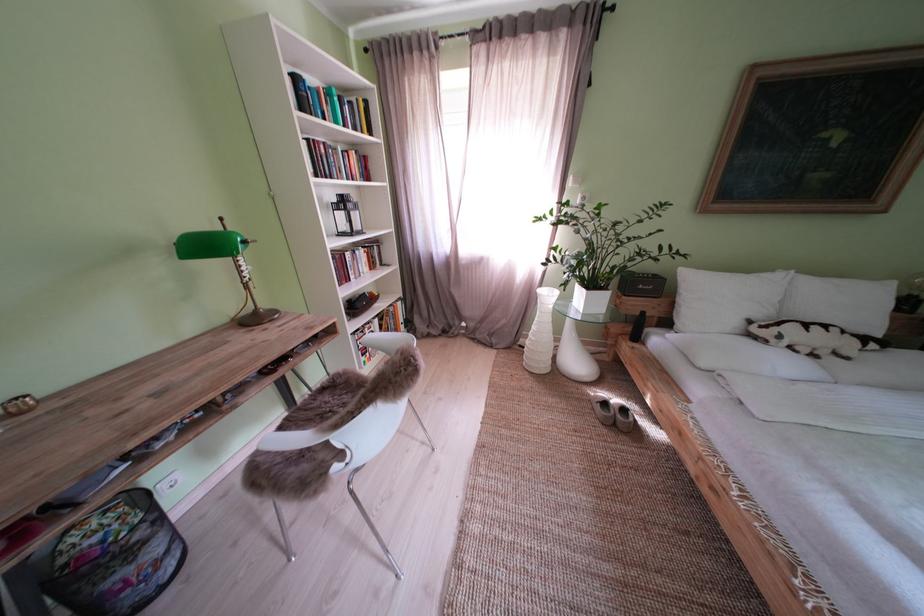
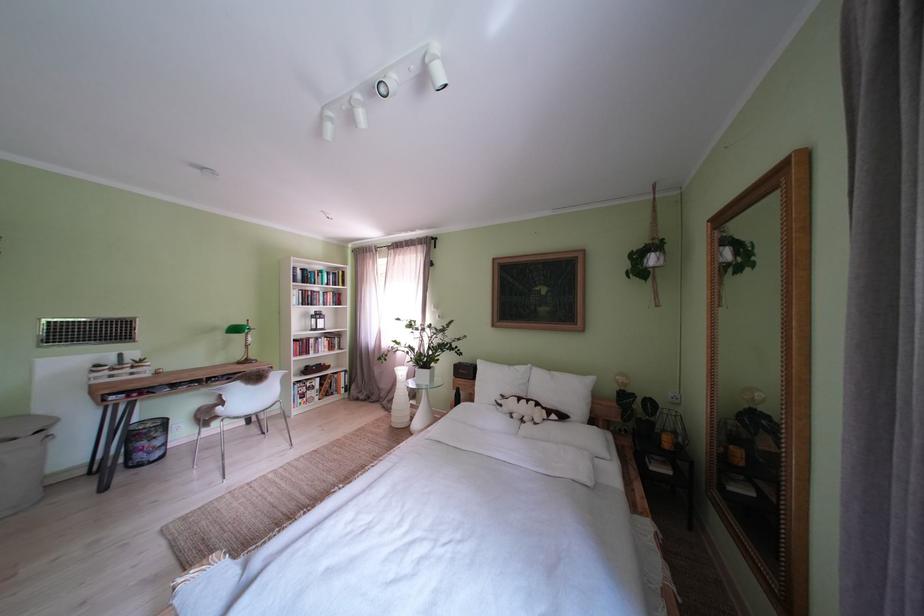
Where in the second image is the point corresponding to [645,280] from the first image?

(472, 369)